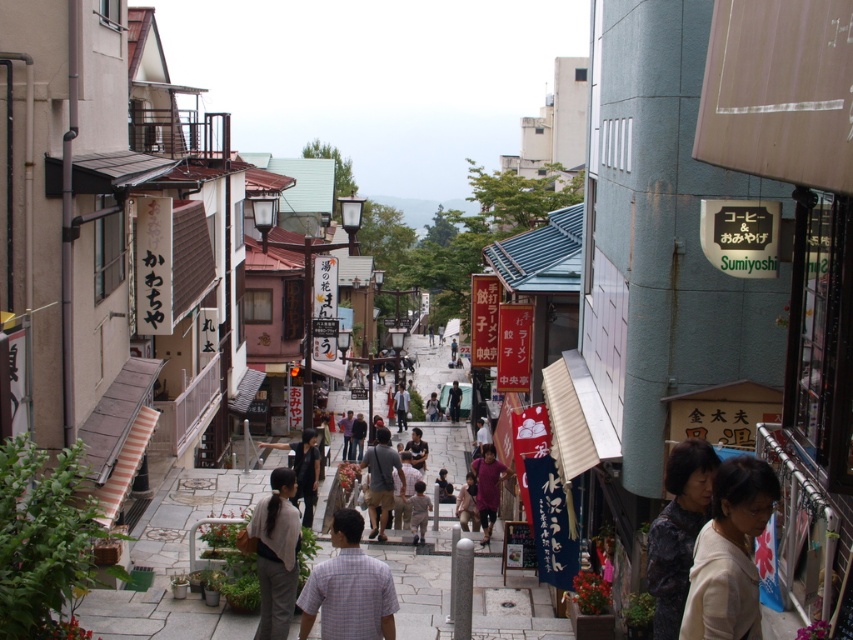
Based on the photo, you are a tourist visiting the Japanese town and want to take a photo of the light beige sweater at lower right and dark gray shirt at center. Which one should you focus on first to ensure both are in the frame?

You should focus on the light beige sweater at lower right first because it is closer to the viewer than the dark gray shirt at center, so adjusting the camera to include both would require starting with the closer object.

You are a tailor observing a group of people on a Japanese street. You need to determine which clothing item is narrower between the light beige sweater at lower right and the dark gray shirt at center. Which one is narrower?

The light beige sweater at lower right has a lesser width compared to the dark gray shirt at center, so the light beige sweater at lower right is narrower.